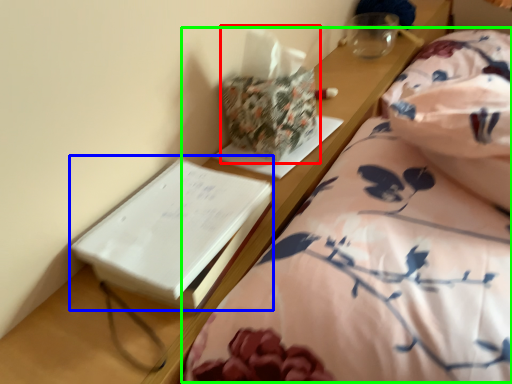
Question: Considering the real-world distances, which object is farthest from package (highlighted by a red box)? paperback book (highlighted by a blue box) or bed (highlighted by a green box)?

Choices:
 (A) paperback book
 (B) bed

Answer: (B)